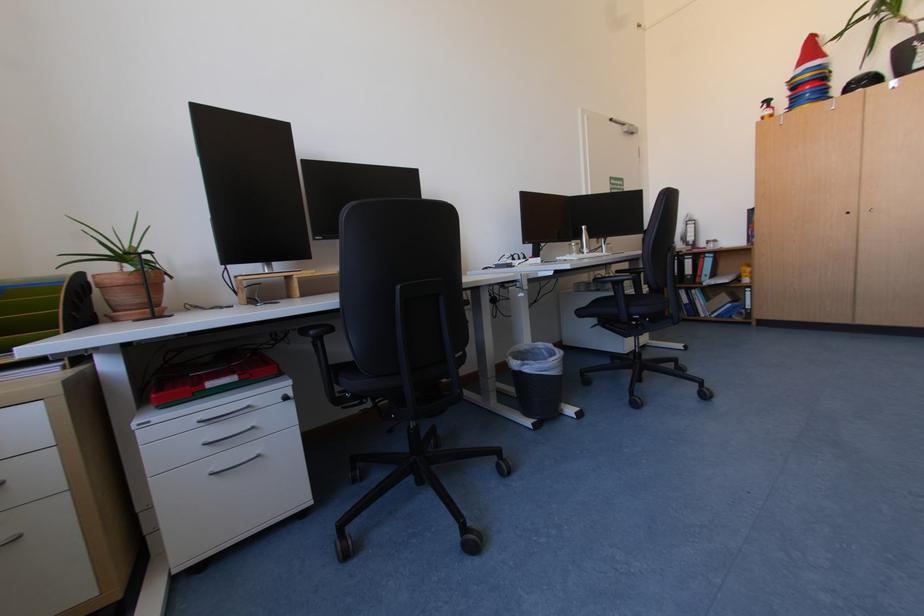
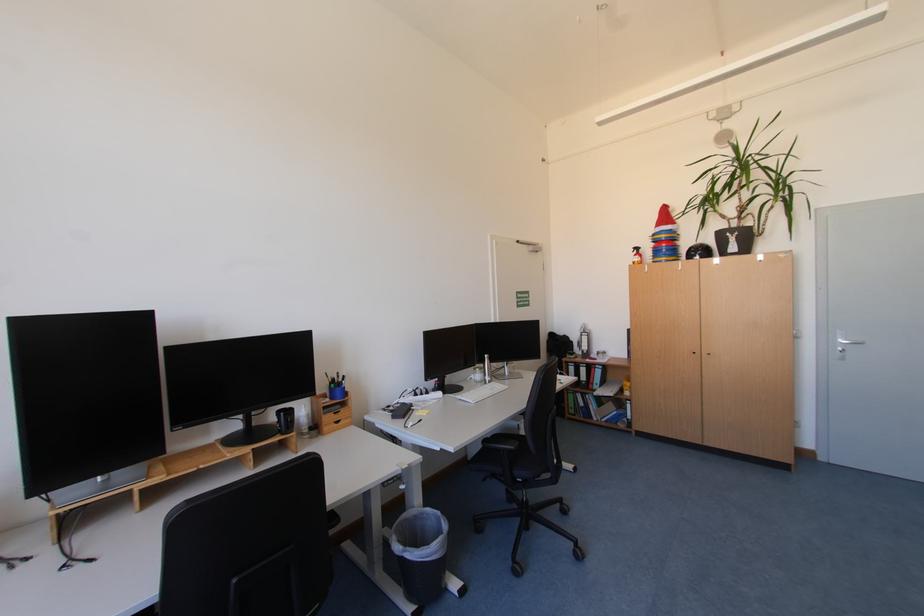
The point at (856, 214) is marked in the first image. Where is the corresponding point in the second image?

(701, 354)